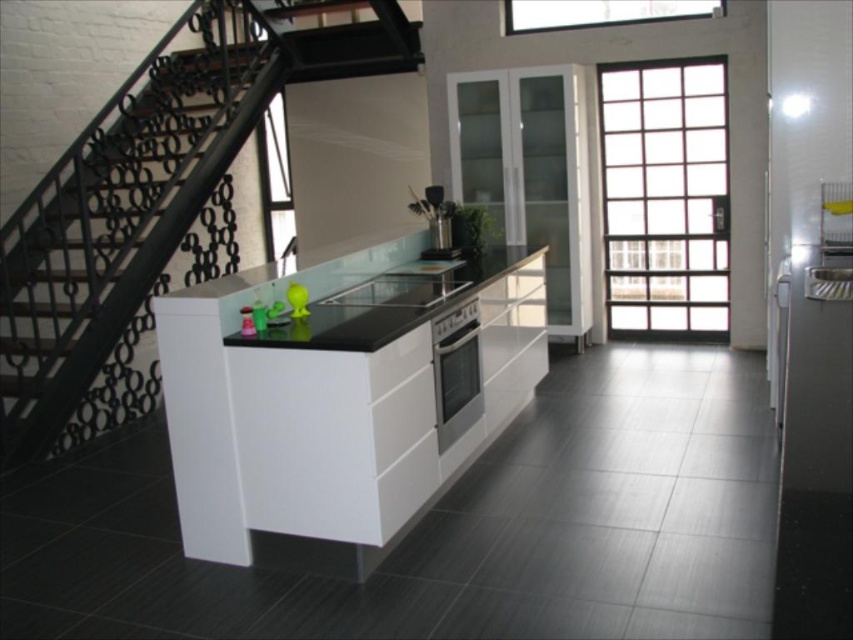
Is glossy black oven at center thinner than metallic silver utensil holder at center?

In fact, glossy black oven at center might be wider than metallic silver utensil holder at center.

Which is in front, point (373, 289) or point (450, 225)?

Point (373, 289) is more forward.

Locate an element on the screen. The width and height of the screenshot is (853, 640). glossy black oven at center is located at coordinates (399, 291).

Does point (358, 468) lie in front of point (454, 248)?

That is True.

The width and height of the screenshot is (853, 640). Find the location of `black glossy counter top at center`. black glossy counter top at center is located at coordinates (340, 403).

Which is behind, point (482, 330) or point (195, 96)?

The point (195, 96) is behind.

Between black glossy counter top at center and black metal stairs at left, which one has more height?

Standing taller between the two is black metal stairs at left.

This screenshot has height=640, width=853. What do you see at coordinates (340, 403) in the screenshot?
I see `black glossy counter top at center` at bounding box center [340, 403].

Find the location of a particular element. black glossy counter top at center is located at coordinates (340, 403).